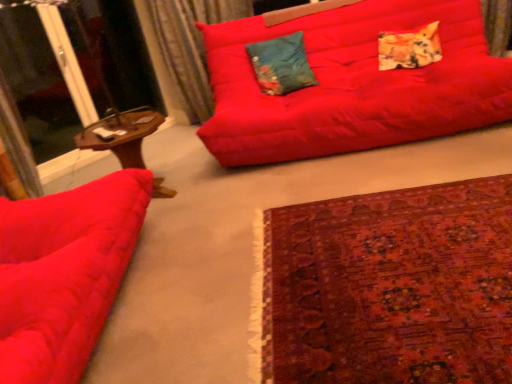
Question: Is velvet curtain at upper left further to the viewer compared to matte red studio couch at left, positioned as the second studio couch in right-to-left order?

Choices:
 (A) yes
 (B) no

Answer: (A)

Question: Is velvet curtain at upper left to the right of matte red studio couch at left, which is counted as the 2th studio couch, starting from the back, from the viewer's perspective?

Choices:
 (A) no
 (B) yes

Answer: (B)

Question: Can you confirm if velvet curtain at upper left is wider than matte red studio couch at left, acting as the first studio couch starting from the left?

Choices:
 (A) no
 (B) yes

Answer: (A)

Question: Is matte red studio couch at left, acting as the first studio couch starting from the left, at the back of velvet curtain at upper left?

Choices:
 (A) yes
 (B) no

Answer: (B)

Question: Considering the relative sizes of velvet curtain at upper left and matte red studio couch at left, acting as the first studio couch starting from the left, in the image provided, is velvet curtain at upper left shorter than matte red studio couch at left, acting as the first studio couch starting from the left,?

Choices:
 (A) yes
 (B) no

Answer: (B)

Question: Would you say carpet with intricate patterns at lower right is inside or outside velvet curtain at upper left?

Choices:
 (A) inside
 (B) outside

Answer: (B)

Question: In terms of height, does carpet with intricate patterns at lower right look taller or shorter compared to velvet curtain at upper left?

Choices:
 (A) short
 (B) tall

Answer: (A)

Question: Does point (298, 301) appear closer or farther from the camera than point (202, 89)?

Choices:
 (A) farther
 (B) closer

Answer: (B)

Question: Looking at the image, does carpet with intricate patterns at lower right seem bigger or smaller compared to velvet curtain at upper left?

Choices:
 (A) small
 (B) big

Answer: (A)

Question: Is point [198, 56] closer or farther from the camera than point [391, 51]?

Choices:
 (A) closer
 (B) farther

Answer: (B)

Question: In terms of size, does velvet curtain at upper left appear bigger or smaller than textured orange-yellow pillow at upper right, which is the 2th pillow in left-to-right order?

Choices:
 (A) small
 (B) big

Answer: (B)

Question: Is velvet curtain at upper left inside or outside of textured orange-yellow pillow at upper right, which is the 2th pillow in left-to-right order?

Choices:
 (A) inside
 (B) outside

Answer: (B)

Question: Considering the positions of velvet curtain at upper left and textured orange-yellow pillow at upper right, which is the 2th pillow in left-to-right order, in the image, is velvet curtain at upper left taller or shorter than textured orange-yellow pillow at upper right, which is the 2th pillow in left-to-right order,?

Choices:
 (A) short
 (B) tall

Answer: (B)

Question: From a real-world perspective, is transparent glass screen door at upper left above or below matte red studio couch at upper center, acting as the first studio couch starting from the back?

Choices:
 (A) below
 (B) above

Answer: (B)

Question: Is transparent glass screen door at upper left to the left or to the right of matte red studio couch at upper center, marked as the 2th studio couch in a left-to-right arrangement, in the image?

Choices:
 (A) right
 (B) left

Answer: (B)